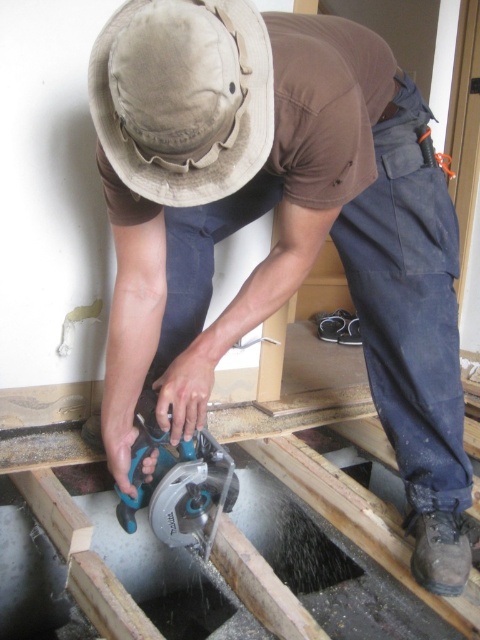
Does tan fabric hat at upper center appear under blue plastic circular saw at center?

No.

Does tan fabric hat at upper center lie behind blue plastic circular saw at center?

That is False.

I want to click on tan fabric hat at upper center, so 182,97.

At what (x,y) coordinates should I click in order to perform the action: click on tan fabric hat at upper center. Please return your answer as a coordinate pair (x, y). Image resolution: width=480 pixels, height=640 pixels. Looking at the image, I should click on (182, 97).